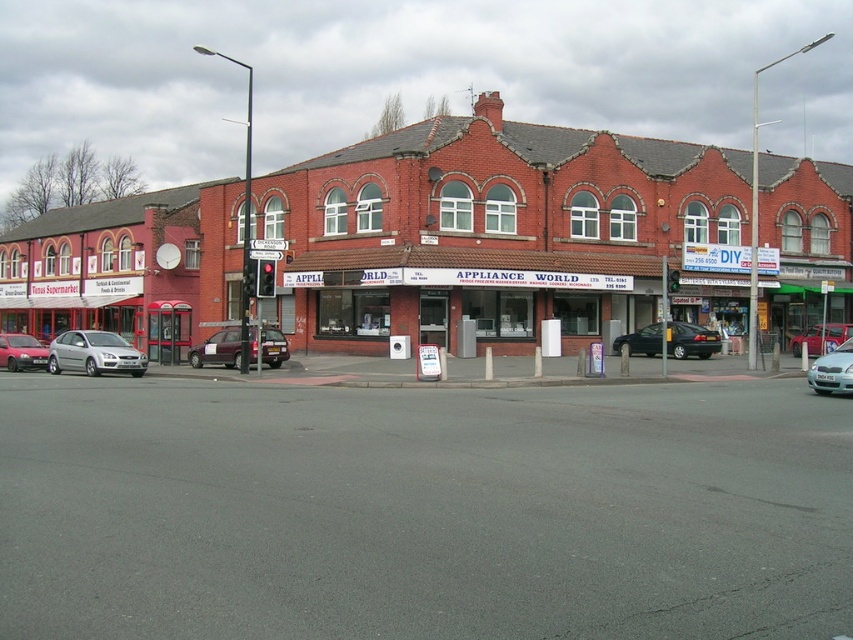
What do you see at coordinates (691, 340) in the screenshot?
I see `shiny black sedan at center` at bounding box center [691, 340].

Who is more forward, (712,349) or (820,348)?

Point (712,349) is in front.

Between point (648, 330) and point (811, 332), which one is positioned in front?

Point (811, 332) is more forward.

This screenshot has width=853, height=640. In order to click on shiny black sedan at center in this screenshot , I will do `click(691, 340)`.

Which is below, gray asphalt at center or silver metallic sedan at left?

gray asphalt at center is below.

Does gray asphalt at center have a larger size compared to silver metallic sedan at left?

Yes.

In order to click on gray asphalt at center in this screenshot , I will do [x=422, y=512].

Can you confirm if silver metallic car at center is thinner than metallic silver car at center?

No.

Is silver metallic car at center bigger than metallic silver car at center?

Yes.

The image size is (853, 640). What do you see at coordinates (833, 371) in the screenshot?
I see `silver metallic car at center` at bounding box center [833, 371].

Locate an element on the screen. silver metallic car at center is located at coordinates (833, 371).